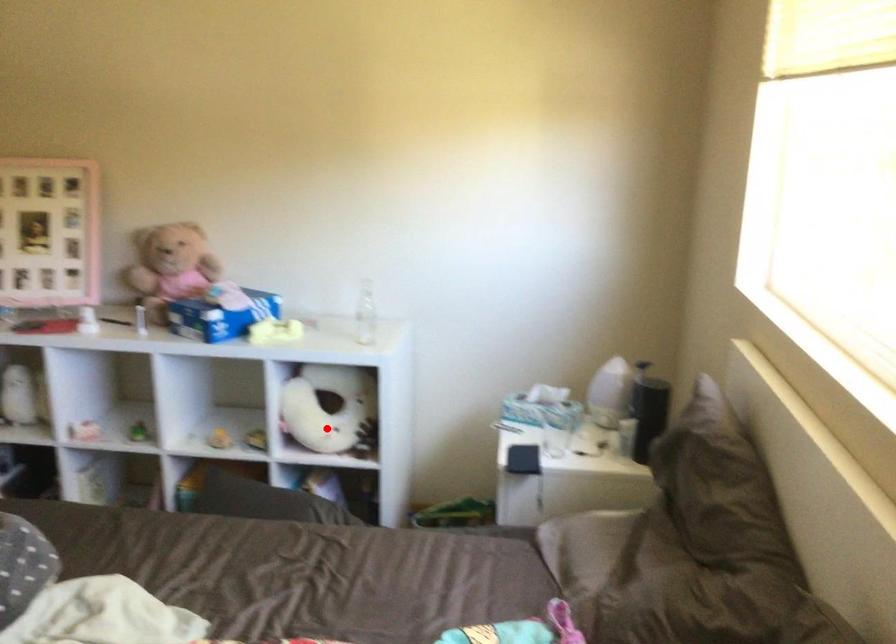
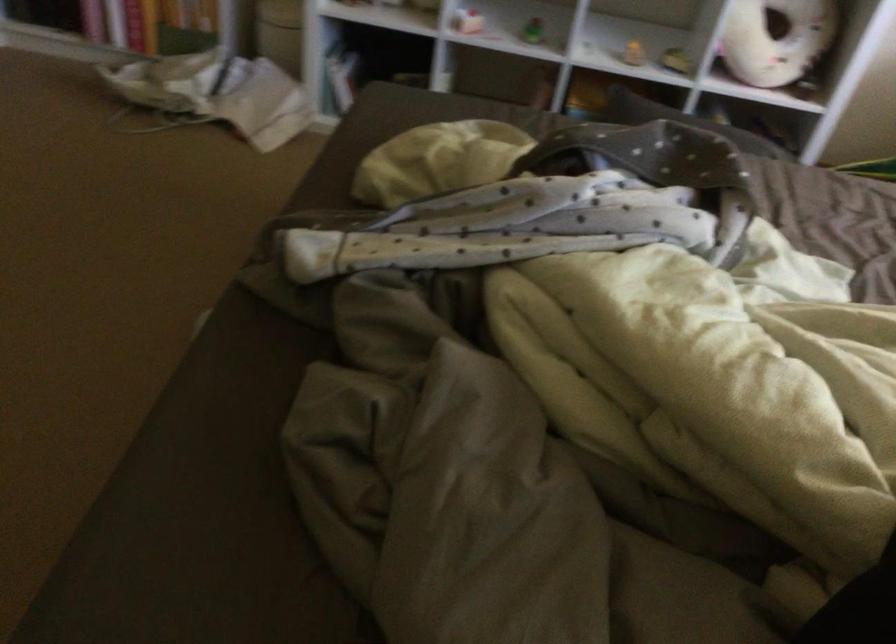
The point at the highlighted location is marked in the first image. Where is the corresponding point in the second image?

(777, 40)